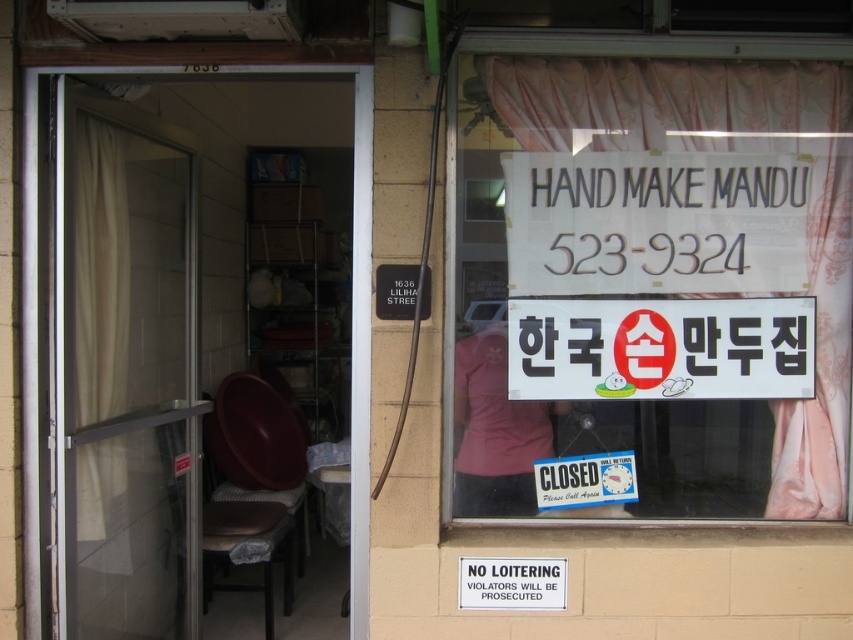
Question: Can you confirm if white plastic sign at upper center is bigger than beige fabric curtain at left?

Choices:
 (A) yes
 (B) no

Answer: (B)

Question: Is transparent glass door at left thinner than white paper sign at upper right?

Choices:
 (A) yes
 (B) no

Answer: (A)

Question: Where is white paper sign at upper right located in relation to white plastic sign at upper center in the image?

Choices:
 (A) above
 (B) below

Answer: (A)

Question: Estimate the real-world distances between objects in this image. Which object is closer to the white plastic sign at upper center?

Choices:
 (A) beige fabric curtain at left
 (B) white paper sign at upper right
 (C) transparent glass door at left

Answer: (B)

Question: Which object appears farthest from the camera in this image?

Choices:
 (A) beige fabric curtain at left
 (B) white paper sign at upper right

Answer: (B)

Question: Among these objects, which one is farthest from the camera?

Choices:
 (A) transparent glass door at left
 (B) beige fabric curtain at left

Answer: (B)